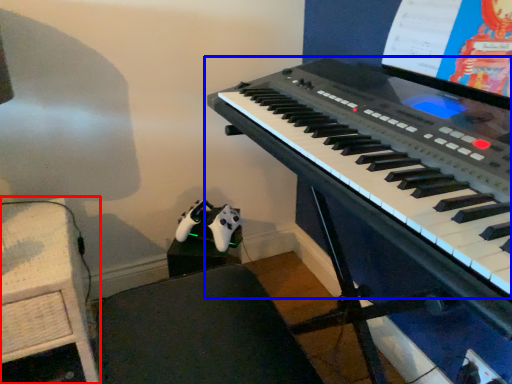
Question: Among these objects, which one is nearest to the camera, table (highlighted by a red box) or musical keyboard (highlighted by a blue box)?

Choices:
 (A) table
 (B) musical keyboard

Answer: (B)